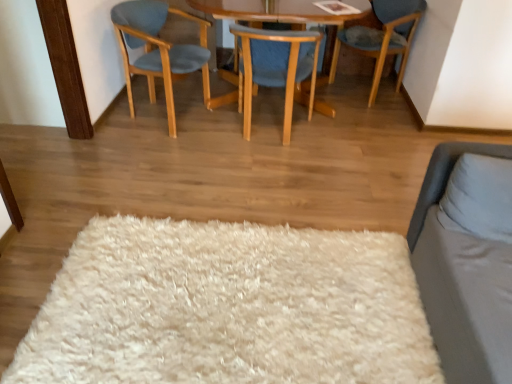
Question: Looking at their shapes, would you say white fluffy rug at center is wider or thinner than blue fabric chair at upper right, which is counted as the first chair, starting from the right?

Choices:
 (A) wide
 (B) thin

Answer: (A)

Question: Considering the positions of point (204, 228) and point (348, 44), is point (204, 228) closer or farther from the camera than point (348, 44)?

Choices:
 (A) closer
 (B) farther

Answer: (A)

Question: Which object is the closest to the wooden chair at center, which ranks as the 2th chair in right-to-left order?

Choices:
 (A) light blue fabric chair at left, which is the 3th chair from right to left
 (B) gray soft pillow at right
 (C) blue fabric chair at upper right, which is counted as the first chair, starting from the right
 (D) white fluffy rug at center

Answer: (A)

Question: Which is nearer to the gray soft pillow at right?

Choices:
 (A) light blue fabric chair at left, marked as the 1th chair in a left-to-right arrangement
 (B) wooden chair at center, marked as the second chair in a left-to-right arrangement
 (C) white fluffy rug at center
 (D) blue fabric chair at upper right, which is counted as the first chair, starting from the right

Answer: (C)